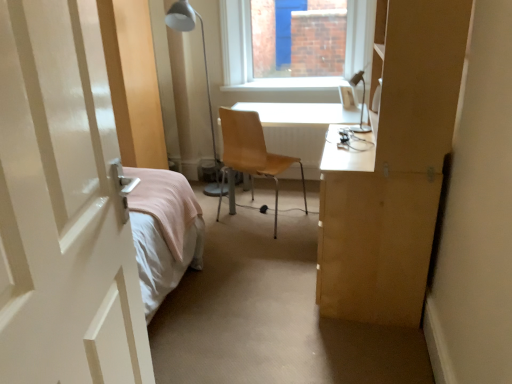
Find the location of a particular element. The image size is (512, 384). free region under light brown wood chair at center (from a real-world perspective) is located at coordinates (254, 226).